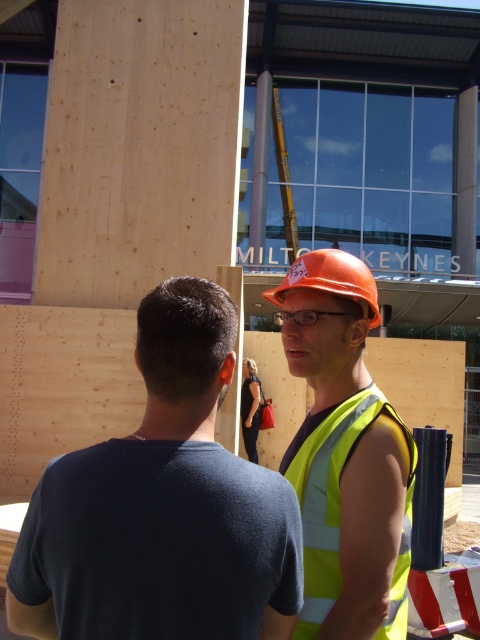
You are standing at the point marked as point (348,452) in the image, which is 5.59 feet away from you. You want to walk towards the large wooden structure under construction in the background. Is the point you are standing at closer to the structure than 6 feet?

The point (348,452) is 5.59 feet away from the viewer, so yes, it is closer than 6 feet to the large wooden structure under construction in the background.

You are a drone operator trying to capture aerial footage of the construction site. You have two points marked on your map, point (124, 588) and point (291, 275). Which point should you prioritize for a closer shot if you want to show details of the structure closer to the camera?

Point (124, 588) should be prioritized because it is closer to the camera than point (291, 275), allowing for clearer details of the structure near the camera.